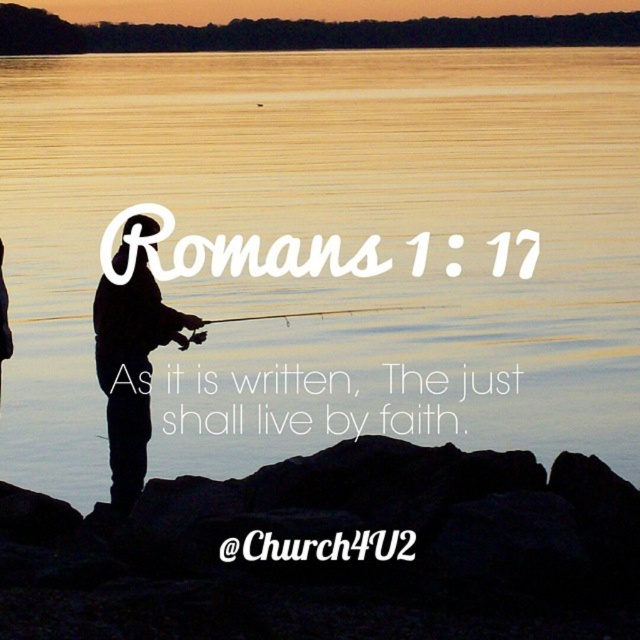
You are a photographer trying to capture the scene of the black matte fisherman at center and the matte black fishing pole at center. Which object appears larger in the photo?

The matte black fishing pole at center appears larger than the black matte fisherman at center in the photo.

Based on the photo, you are a photographer positioned at the rocky outcrop where the person is standing. You want to capture a photo that includes both the silvery water at center and the matte black fishing pole at center. Given the distance between them, will the camera lens need to be zoomed in or zoomed out to ensure both are fully visible in the frame?

The silvery water at center is 67.87 feet from the matte black fishing pole at center. To ensure both are fully visible in the frame, the camera lens should be zoomed out.